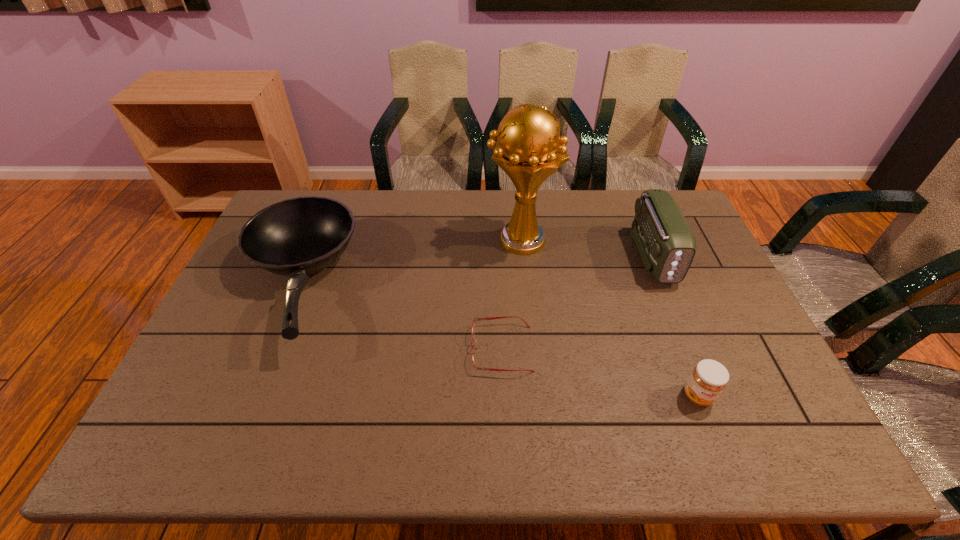
This screenshot has height=540, width=960. I want to click on free space between the jam and the third shortest object, so click(x=497, y=340).

Find the location of a particular element. free space between the nearest object and the spectacles is located at coordinates (600, 372).

Locate an element on the screen. vacant space that's between the leftmost object and the spectacles is located at coordinates (399, 316).

Locate an element on the screen. This screenshot has width=960, height=540. empty space between the second shortest object and the fourth shortest object is located at coordinates (675, 326).

The width and height of the screenshot is (960, 540). Find the location of `free space that is in between the jam and the shortest object`. free space that is in between the jam and the shortest object is located at coordinates click(600, 372).

Image resolution: width=960 pixels, height=540 pixels. Identify the location of empty space that is in between the shortest object and the second shortest object. (600, 372).

Locate an element on the screen. The height and width of the screenshot is (540, 960). unoccupied area between the trophy_cup and the radio_receiver is located at coordinates (587, 248).

Locate which object ranks second in proximity to the frying pan. Please provide its 2D coordinates. Your answer should be formatted as a tuple, i.e. [(x, y)], where the tuple contains the x and y coordinates of a point satisfying the conditions above.

[(529, 149)]

In order to click on object that is the fourth closest to the fourth shortest object in this screenshot , I will do `click(296, 237)`.

Where is `vacant space that satisfies the following two spatial constraints: 1. on the front-facing side of the radio_receiver; 2. on the lenses of the spectacles`? vacant space that satisfies the following two spatial constraints: 1. on the front-facing side of the radio_receiver; 2. on the lenses of the spectacles is located at coordinates (691, 349).